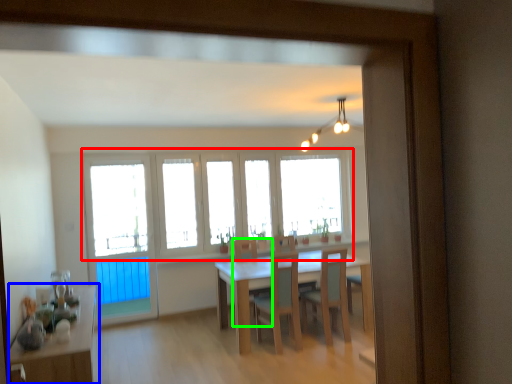
Question: Estimate the real-world distances between objects in this image. Which object is closer to window (highlighted by a red box), table (highlighted by a blue box) or armchair (highlighted by a green box)?

Choices:
 (A) table
 (B) armchair

Answer: (B)